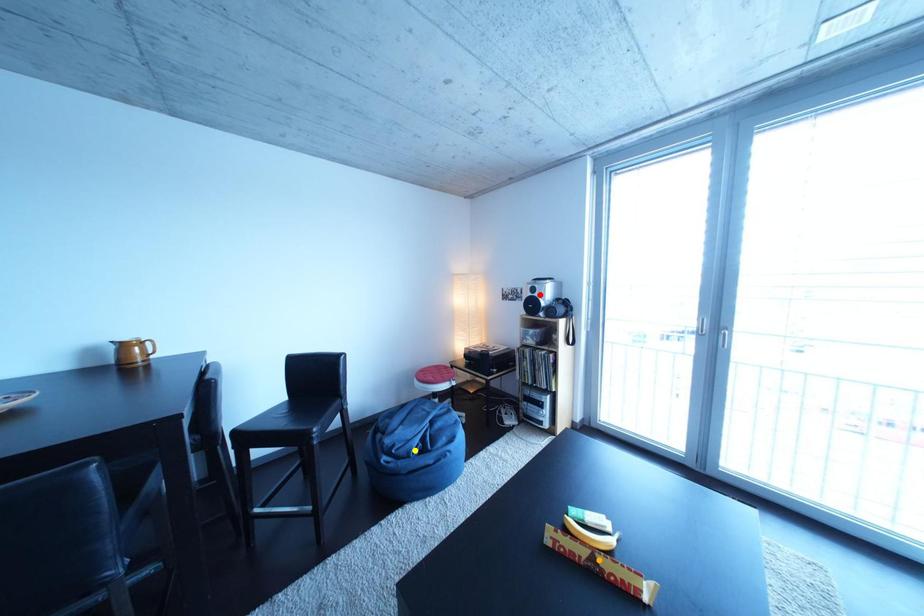
Order these from farthest to nearest:
red point
orange point
yellow point

red point
yellow point
orange point